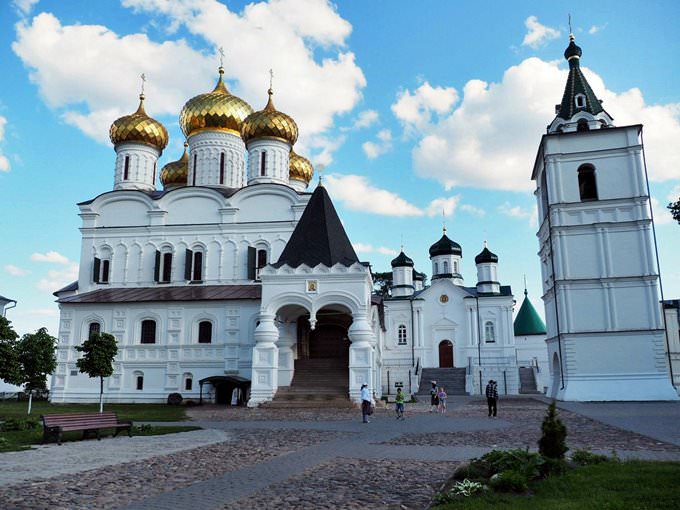
This screenshot has height=510, width=680. In order to click on entrance in this screenshot , I will do `click(305, 374)`.